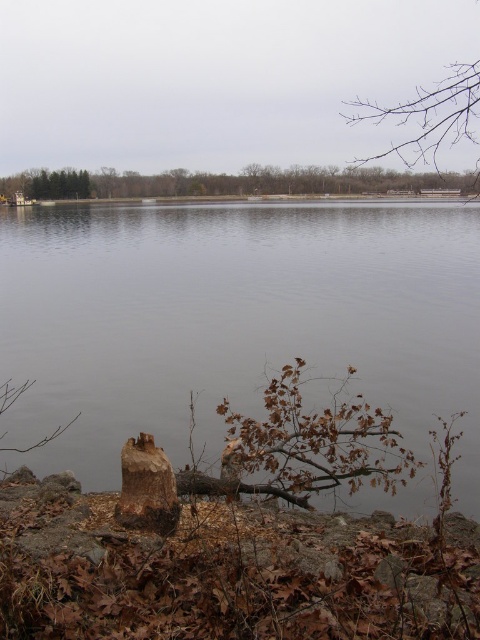
Question: Which point is closer to the camera?

Choices:
 (A) brown rough wood stump at lower center
 (B) gray water at center
 (C) brown wood tree at center
 (D) brown rough tree trunk at lower center

Answer: (A)

Question: Which point is farther from the camera taking this photo?

Choices:
 (A) (315, 172)
 (B) (148, 449)

Answer: (A)

Question: Can you confirm if bare branch at upper right is positioned above brown rough wood stump at lower center?

Choices:
 (A) yes
 (B) no

Answer: (A)

Question: Which object is closer to the camera taking this photo?

Choices:
 (A) brown rough tree trunk at lower center
 (B) brown wood tree at center

Answer: (A)

Question: Is brown wood tree at center to the right of bare branch at upper right from the viewer's perspective?

Choices:
 (A) no
 (B) yes

Answer: (A)

Question: Is the position of brown wood tree at center more distant than that of bare branch at upper right?

Choices:
 (A) no
 (B) yes

Answer: (B)